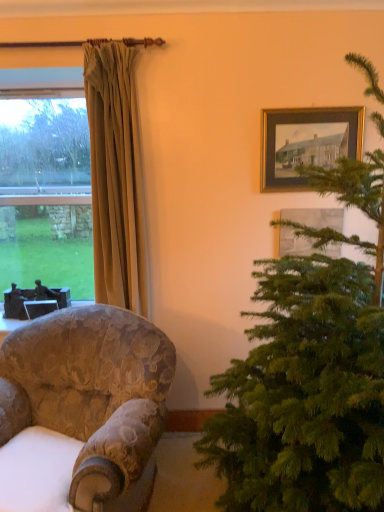
This screenshot has height=512, width=384. Describe the element at coordinates (116, 177) in the screenshot. I see `beige fabric curtain at left` at that location.

From the picture: What is the approximate height of beige fabric curtain at left?

beige fabric curtain at left is 5.35 feet in height.

In order to face gold-framed picture at upper right, positioned as the first picture frame in top-to-bottom order, should I rotate leftwards or rightwards?

Rotate your view right by about 15.531°.

This screenshot has height=512, width=384. What do you see at coordinates (40, 307) in the screenshot?
I see `metallic silver picture frame at upper left, the third picture frame in the top-to-bottom sequence` at bounding box center [40, 307].

What are the coordinates of `floral fabric armchair at lower left` in the screenshot? It's located at (92, 397).

Can you tell me how much clear glass window at left and gold-framed picture at upper right, which ranks as the 3th picture frame in back-to-front order, differ in facing direction?

The facing directions of clear glass window at left and gold-framed picture at upper right, which ranks as the 3th picture frame in back-to-front order, are 0.0822 degrees apart.

Which of these two, clear glass window at left or gold-framed picture at upper right, which ranks as the 3th picture frame in back-to-front order, is smaller?

Smaller between the two is gold-framed picture at upper right, which ranks as the 3th picture frame in back-to-front order.

Which is more to the right, clear glass window at left or gold-framed picture at upper right, which is the 2th picture frame from left to right?

Positioned to the right is gold-framed picture at upper right, which is the 2th picture frame from left to right.

Can we say clear glass window at left lies outside gold-framed picture at upper right, which is the 2th picture frame from left to right?

clear glass window at left lies outside gold-framed picture at upper right, which is the 2th picture frame from left to right,'s area.

Would you say wooden framed picture at upper right, the 1th picture frame from the right, is outside green needle-like at right?

Indeed, wooden framed picture at upper right, the 1th picture frame from the right, is completely outside green needle-like at right.

Which of these two, wooden framed picture at upper right, the 2th picture frame in the top-to-bottom sequence, or green needle-like at right, is bigger?

green needle-like at right.

From the image's perspective, does wooden framed picture at upper right, which is the third picture frame in left-to-right order, appear lower than green needle-like at right?

Incorrect, from the image's perspective, wooden framed picture at upper right, which is the third picture frame in left-to-right order, is higher than green needle-like at right.

Visually, is wooden framed picture at upper right, acting as the 2th picture frame starting from the bottom, positioned to the left or to the right of green needle-like at right?

Clearly, wooden framed picture at upper right, acting as the 2th picture frame starting from the bottom, is on the right of green needle-like at right in the image.

From a real-world perspective, is gold-framed picture at upper right, which is the 2th picture frame from left to right, beneath floral fabric armchair at lower left?

Actually, gold-framed picture at upper right, which is the 2th picture frame from left to right, is physically above floral fabric armchair at lower left in the real world.

Is gold-framed picture at upper right, which ranks as the 3th picture frame in back-to-front order, not within floral fabric armchair at lower left?

Yes.

Which of these two, gold-framed picture at upper right, which is the 2th picture frame from left to right, or floral fabric armchair at lower left, is smaller?

gold-framed picture at upper right, which is the 2th picture frame from left to right, is smaller.

Which is correct: floral fabric armchair at lower left is inside gold-framed picture at upper right, positioned as the first picture frame in top-to-bottom order, or outside of it?

floral fabric armchair at lower left is not inside gold-framed picture at upper right, positioned as the first picture frame in top-to-bottom order, it's outside.

Is floral fabric armchair at lower left further to the viewer compared to gold-framed picture at upper right, positioned as the first picture frame in top-to-bottom order?

No, floral fabric armchair at lower left is in front of gold-framed picture at upper right, positioned as the first picture frame in top-to-bottom order.

Identify the location of chair on the left of gold-framed picture at upper right, positioned as the first picture frame in top-to-bottom order. (92, 397).

Based on their positions, is floral fabric armchair at lower left located to the left or right of gold-framed picture at upper right, which is the 2th picture frame from left to right?

floral fabric armchair at lower left is to the left of gold-framed picture at upper right, which is the 2th picture frame from left to right.

Find the location of a particular element. picture frame below the green needle-like at right (from a real-world perspective) is located at coordinates 40,307.

Measure the distance from metallic silver picture frame at upper left, the 3th picture frame in the front-to-back sequence, to green needle-like at right.

metallic silver picture frame at upper left, the 3th picture frame in the front-to-back sequence, and green needle-like at right are 1.76 meters apart.

Looking at this image, how different are the orientations of metallic silver picture frame at upper left, the third picture frame viewed from the right, and green needle-like at right in degrees?

The angle between the facing direction of metallic silver picture frame at upper left, the third picture frame viewed from the right, and the facing direction of green needle-like at right is 90 degrees.

In the scene shown: Which object is wider, metallic silver picture frame at upper left, the 3th picture frame in the front-to-back sequence, or green needle-like at right?

green needle-like at right.

Is metallic silver picture frame at upper left, the third picture frame viewed from the right, not inside wooden framed picture at upper right, the 1th picture frame from the right?

Yes.

Looking at the image, does metallic silver picture frame at upper left, the 3th picture frame in the front-to-back sequence, seem bigger or smaller compared to wooden framed picture at upper right, the 2th picture frame in the top-to-bottom sequence?

Considering their sizes, metallic silver picture frame at upper left, the 3th picture frame in the front-to-back sequence, takes up more space than wooden framed picture at upper right, the 2th picture frame in the top-to-bottom sequence.

Looking at this image, from the image's perspective, is metallic silver picture frame at upper left, the first picture frame viewed from the back, on top of wooden framed picture at upper right, positioned as the second picture frame in front-to-back order?

No, from the image's perspective, metallic silver picture frame at upper left, the first picture frame viewed from the back, is not on top of wooden framed picture at upper right, positioned as the second picture frame in front-to-back order.

Locate an element on the screen. Image resolution: width=384 pixels, height=512 pixels. curtain on the right of metallic silver picture frame at upper left, the 1th picture frame ordered from the bottom is located at coordinates coord(116,177).

Which object is more forward, metallic silver picture frame at upper left, marked as the 1th picture frame in a left-to-right arrangement, or beige fabric curtain at left?

Positioned in front is beige fabric curtain at left.

Is metallic silver picture frame at upper left, marked as the 1th picture frame in a left-to-right arrangement, placed right next to beige fabric curtain at left?

No, metallic silver picture frame at upper left, marked as the 1th picture frame in a left-to-right arrangement, is not touching beige fabric curtain at left.

Is metallic silver picture frame at upper left, the first picture frame viewed from the back, positioned beyond the bounds of beige fabric curtain at left?

That's correct, metallic silver picture frame at upper left, the first picture frame viewed from the back, is outside of beige fabric curtain at left.

Locate an element on the screen. The height and width of the screenshot is (512, 384). window behind the gold-framed picture at upper right, positioned as the 2th picture frame in right-to-left order is located at coordinates (46, 195).

I want to click on the 1st picture frame above the green needle-like at right (from the image's perspective), so click(x=315, y=217).

Which object lies nearer to the anchor point floral fabric armchair at lower left, clear glass window at left or metallic silver picture frame at upper left, the first picture frame viewed from the back?

→ metallic silver picture frame at upper left, the first picture frame viewed from the back.

Which object lies nearer to the anchor point metallic silver picture frame at upper left, the 3th picture frame in the front-to-back sequence, gold-framed picture at upper right, positioned as the first picture frame in top-to-bottom order, or green needle-like at right?

green needle-like at right.

Estimate the real-world distances between objects in this image. Which object is closer to clear glass window at left, wooden framed picture at upper right, positioned as the second picture frame in front-to-back order, or beige fabric curtain at left?

beige fabric curtain at left lies closer to clear glass window at left than the other object.

Considering their positions, is green needle-like at right positioned further to gold-framed picture at upper right, positioned as the 2th picture frame in right-to-left order, than wooden framed picture at upper right, acting as the 2th picture frame starting from the bottom?

green needle-like at right.

Considering their positions, is wooden framed picture at upper right, the 2th picture frame in the top-to-bottom sequence, positioned closer to clear glass window at left than green needle-like at right?

Among the two, wooden framed picture at upper right, the 2th picture frame in the top-to-bottom sequence, is located nearer to clear glass window at left.

Estimate the real-world distances between objects in this image. Which object is closer to beige fabric curtain at left, green needle-like at right or floral fabric armchair at lower left?

Among the two, floral fabric armchair at lower left is located nearer to beige fabric curtain at left.

Looking at the image, which one is located closer to wooden framed picture at upper right, which is the 2th picture frame in back-to-front order, metallic silver picture frame at upper left, the third picture frame viewed from the right, or clear glass window at left?

Based on the image, clear glass window at left appears to be nearer to wooden framed picture at upper right, which is the 2th picture frame in back-to-front order.

Based on their spatial positions, is wooden framed picture at upper right, positioned as the second picture frame in front-to-back order, or floral fabric armchair at lower left closer to beige fabric curtain at left?

floral fabric armchair at lower left is positioned closer to the anchor beige fabric curtain at left.

Identify the location of chair between clear glass window at left and wooden framed picture at upper right, the 2th picture frame in the top-to-bottom sequence, in the horizontal direction. Image resolution: width=384 pixels, height=512 pixels. [x=92, y=397].

The width and height of the screenshot is (384, 512). I want to click on curtain between green needle-like at right and clear glass window at left from front to back, so click(x=116, y=177).

Where is `curtain between green needle-like at right and gold-framed picture at upper right, positioned as the first picture frame in top-to-bottom order, from front to back`? This screenshot has height=512, width=384. curtain between green needle-like at right and gold-framed picture at upper right, positioned as the first picture frame in top-to-bottom order, from front to back is located at coordinates (116, 177).

At what (x,y) coordinates should I click in order to perform the action: click on curtain between clear glass window at left and wooden framed picture at upper right, positioned as the second picture frame in front-to-back order, from left to right. Please return your answer as a coordinate pair (x, y). The image size is (384, 512). Looking at the image, I should click on (116, 177).